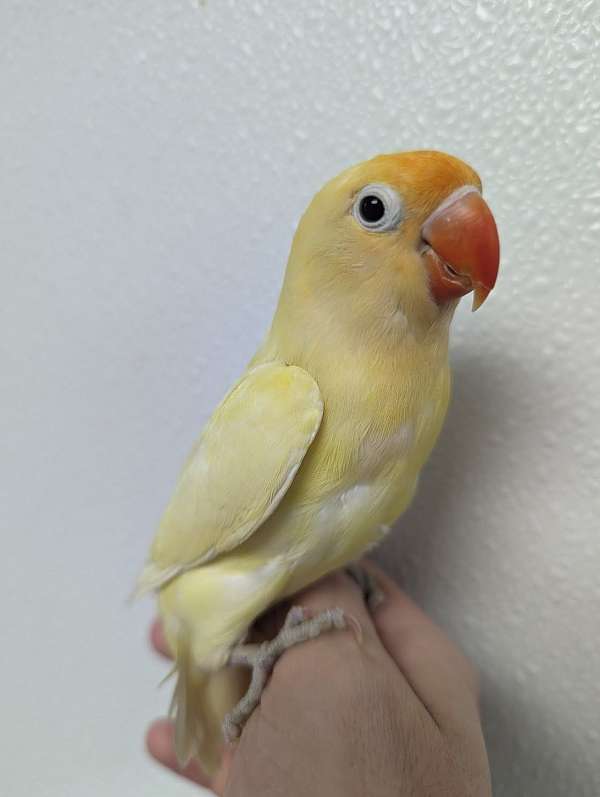
The image size is (600, 797). What are the coordinates of `wall` in the screenshot? It's located at (562, 576).